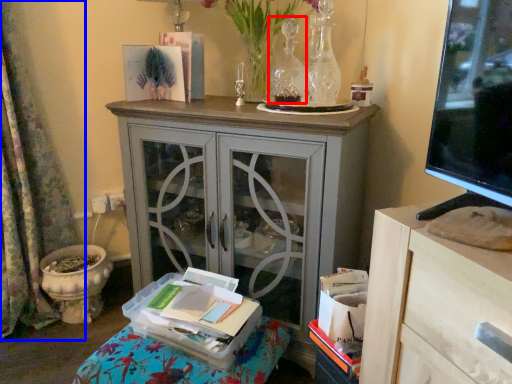
Question: Which object is closer to the camera taking this photo, vase (highlighted by a red box) or curtain (highlighted by a blue box)?

Choices:
 (A) vase
 (B) curtain

Answer: (B)